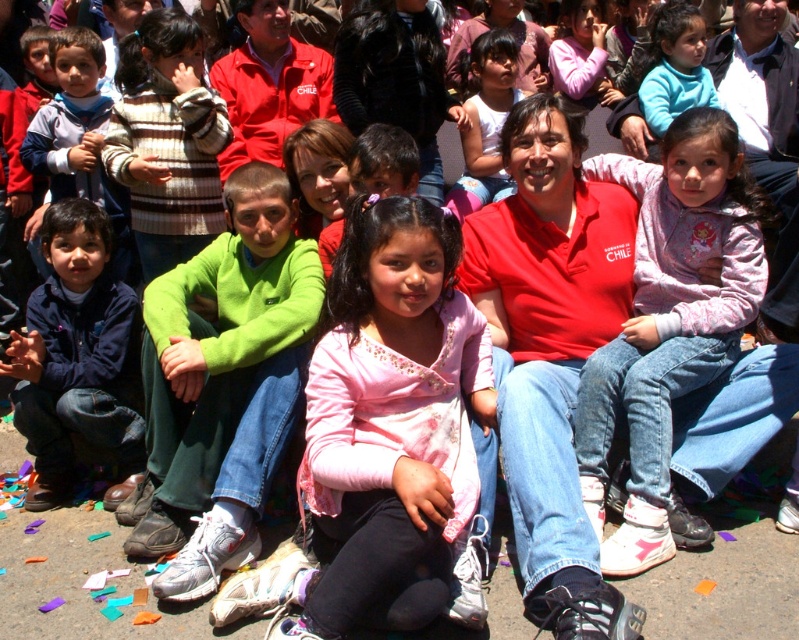
You are standing at the camera position and want to take a photo of the two points mentioned. Which point is closer to you, point at [114,80] or point at [507,184]?

Point at [114,80] is in front of point at [507,184], so it is closer to you.